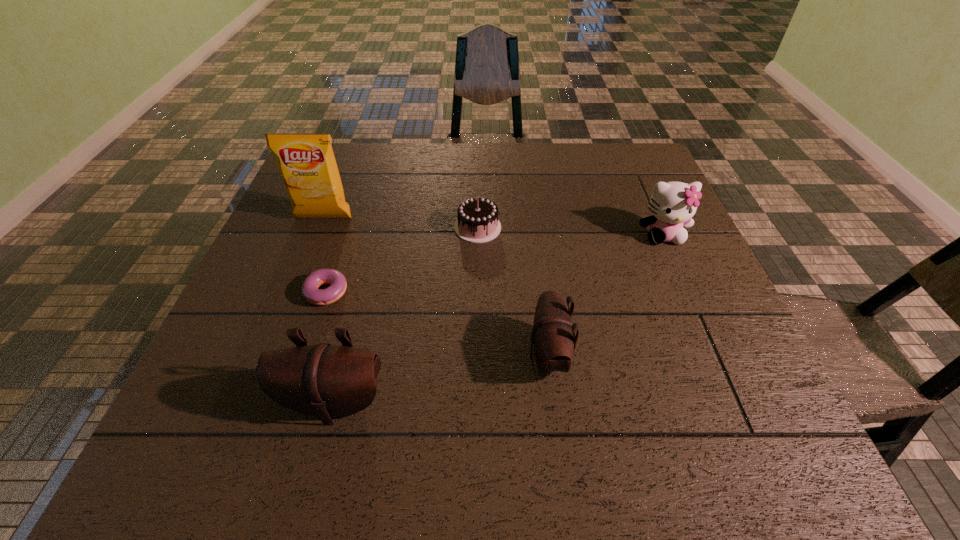
Identify the location of blank space located with the flap open on the shorter pouch. (446, 355).

Image resolution: width=960 pixels, height=540 pixels. I want to click on vacant space located with the flap open on the shorter pouch, so point(349,355).

Where is `vacant space situated 0.350m on the back of the chocolate cake`? The image size is (960, 540). vacant space situated 0.350m on the back of the chocolate cake is located at coordinates pos(478,146).

Locate an element on the screen. vacant region located on the front-facing side of the rightmost object is located at coordinates (687, 291).

The height and width of the screenshot is (540, 960). In order to click on free space located on the back of the fourth farthest object in this screenshot , I will do tap(342, 259).

Image resolution: width=960 pixels, height=540 pixels. I want to click on vacant area situated on the front of the crisp (potato chip) with the logo, so [313, 245].

In order to click on doughnut positioned at the left edge in this screenshot , I will do pyautogui.click(x=310, y=291).

Where is `crisp (potato chip) present at the left edge`? crisp (potato chip) present at the left edge is located at coordinates (307, 164).

The image size is (960, 540). I want to click on object that is at the right edge, so click(x=672, y=204).

You are a GUI agent. You are given a task and a screenshot of the screen. Output one action in this format:
    pyautogui.click(x=<x>, y=<y>)
    Task: Click on the vacant area at the far edge
    
    Given the screenshot: What is the action you would take?
    tap(550, 156)